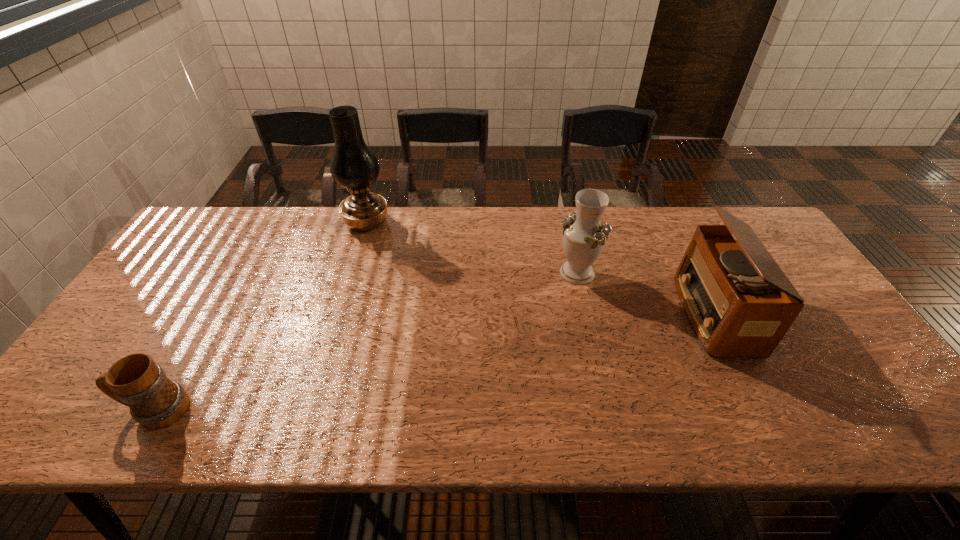
At what (x,y) coordinates should I click in order to perform the action: click on unoccupied area between the vase and the radio receiver. Please return your answer as a coordinate pair (x, y). This screenshot has width=960, height=540. Looking at the image, I should click on (645, 293).

Identify the location of the third closest object to the mug. (739, 302).

Identify which object is located as the nearest to the rightmost object. Please provide its 2D coordinates. Your answer should be formatted as a tuple, i.e. [(x, y)], where the tuple contains the x and y coordinates of a point satisfying the conditions above.

[(584, 237)]

This screenshot has width=960, height=540. In order to click on vacant space that satisfies the following two spatial constraints: 1. on the front side of the third object from right to left; 2. on the side of the nearest object with the handle in this screenshot , I will do `click(309, 410)`.